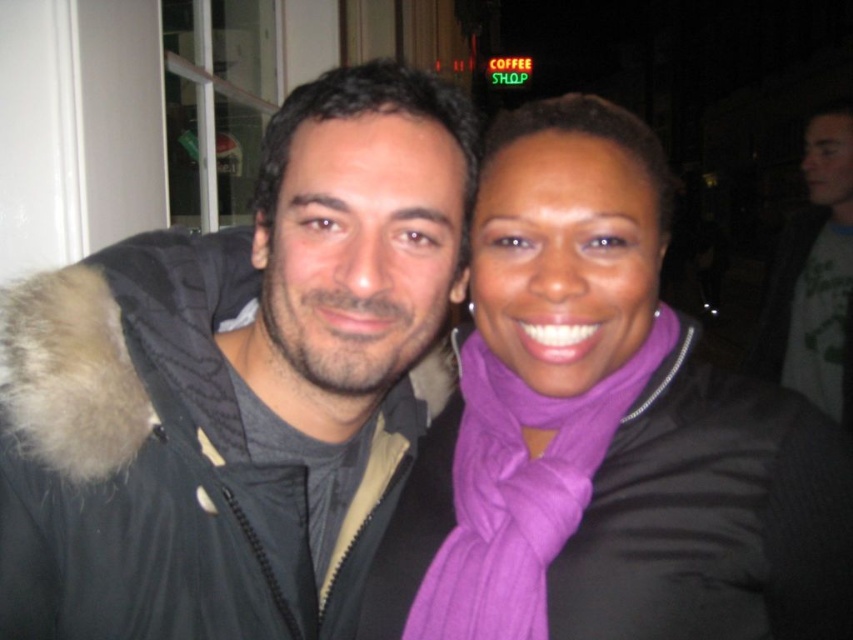
Question: Does purple soft scarf at center have a lesser width compared to purple soft scarf at right?

Choices:
 (A) yes
 (B) no

Answer: (B)

Question: Estimate the real-world distances between objects in this image. Which object is closer to the purple soft scarf at right?

Choices:
 (A) matte gray jacket at right
 (B) matte black jacket at left

Answer: (B)

Question: Which object appears closest to the camera in this image?

Choices:
 (A) matte gray jacket at right
 (B) matte black jacket at left

Answer: (B)

Question: Does purple soft scarf at center appear over matte gray jacket at right?

Choices:
 (A) yes
 (B) no

Answer: (B)

Question: Which of the following is the farthest from the observer?

Choices:
 (A) (627, 298)
 (B) (415, 316)
 (C) (792, 266)

Answer: (C)

Question: Is matte black jacket at left above purple soft scarf at center?

Choices:
 (A) yes
 (B) no

Answer: (A)